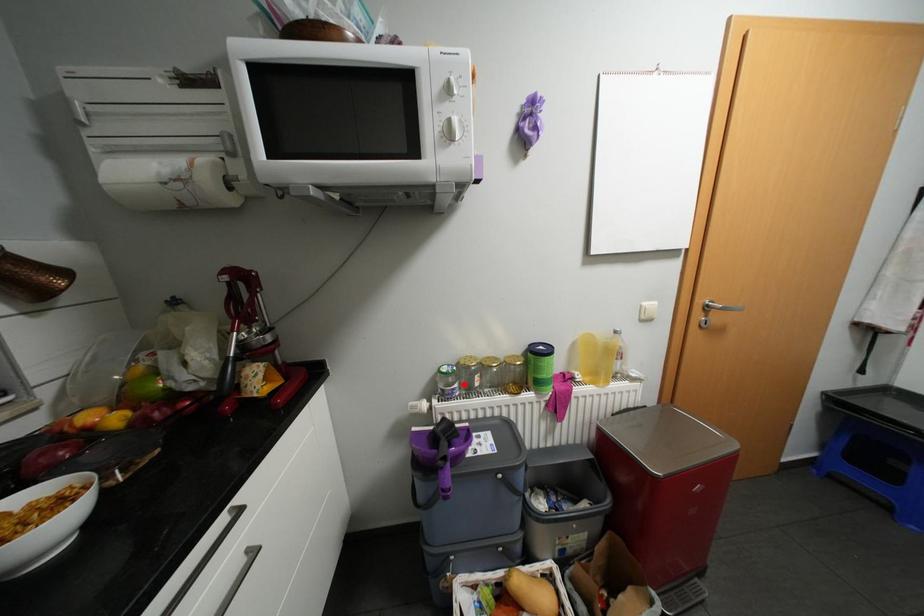
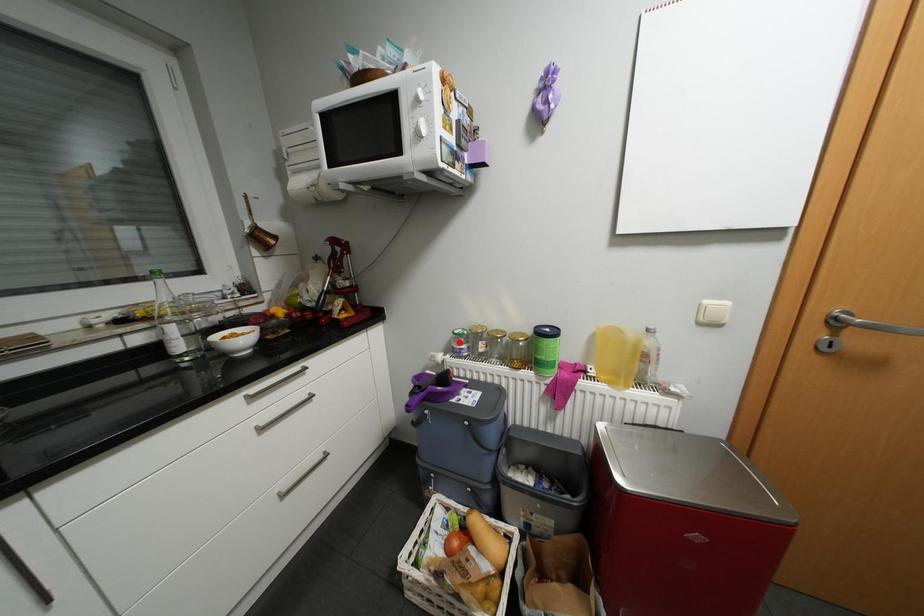
I am providing you with two images of the same scene from different viewpoints. A red point is marked on the first image and another point is marked on the second image. Is the marked point in image1 the same physical position as the marked point in image2?

No